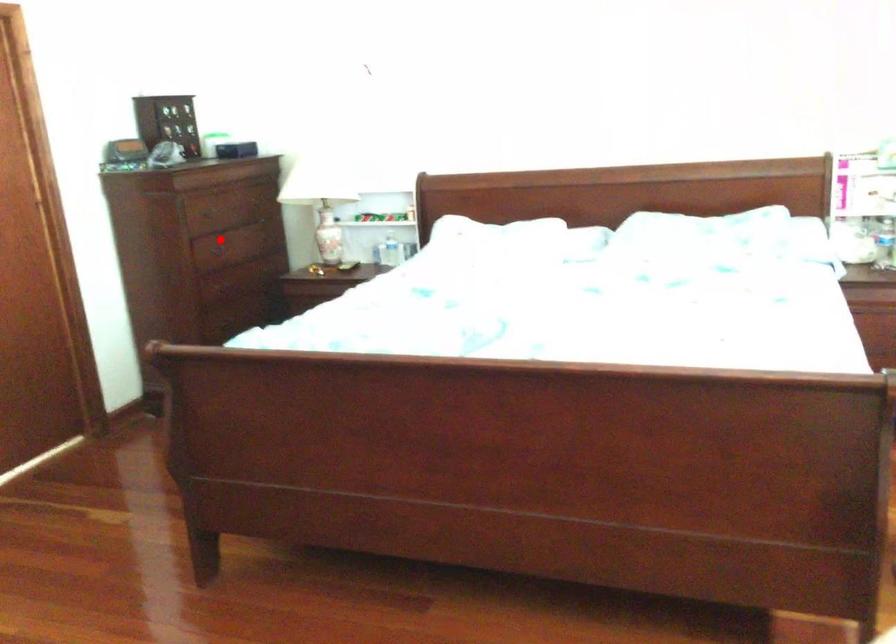
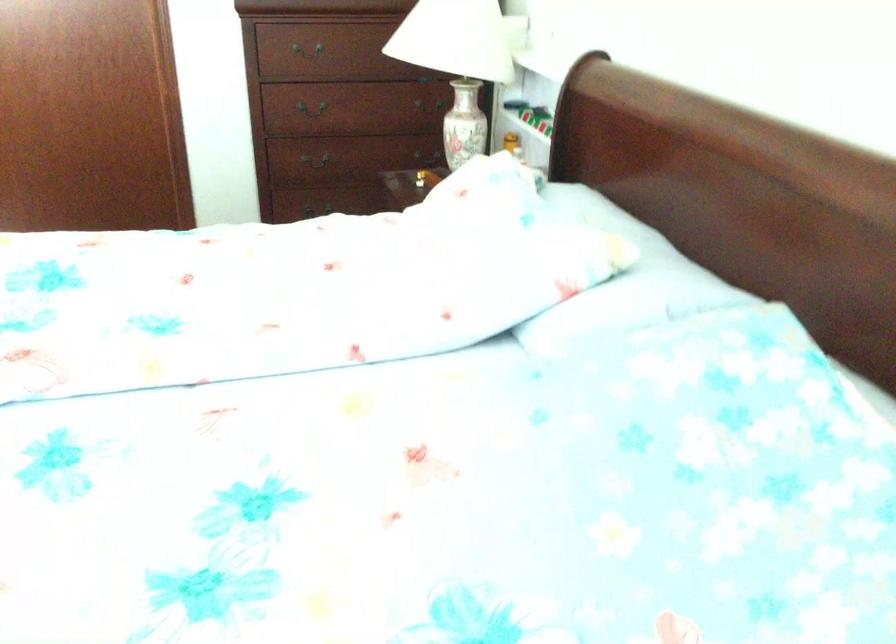
Locate, in the second image, the point that corresponds to the highlighted location in the first image.

(309, 52)